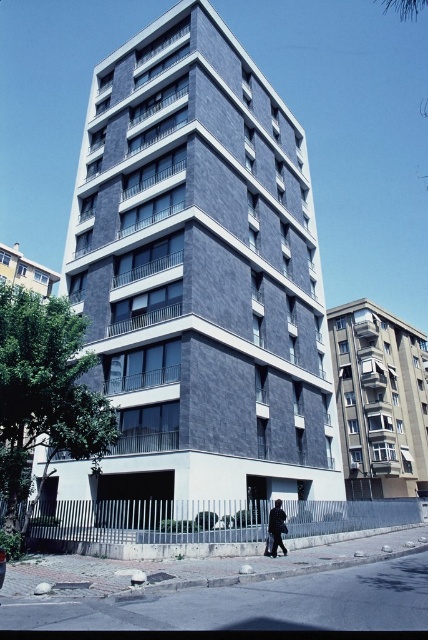
Is point (372, 413) farther from camera compared to point (8, 280)?

That is False.

Identify the location of dark gray stone building at right. click(x=380, y=401).

Between dark gray stone building at center and dark blue jacket at lower center, which one appears on the right side from the viewer's perspective?

dark blue jacket at lower center

Is dark gray stone building at center bigger than dark blue jacket at lower center?

Indeed, dark gray stone building at center has a larger size compared to dark blue jacket at lower center.

What do you see at coordinates (196, 285) in the screenshot?
I see `dark gray stone building at center` at bounding box center [196, 285].

Locate an element on the screen. The width and height of the screenshot is (428, 640). dark gray stone building at center is located at coordinates (196, 285).

Which is above, dark gray stone building at center or dark gray stone building at right?

dark gray stone building at center

Can you confirm if dark gray stone building at center is wider than dark gray stone building at right?

No.

Which is in front, point (109, 472) or point (365, 480)?

Point (109, 472) is in front.

Where is `dark gray stone building at center`? The height and width of the screenshot is (640, 428). dark gray stone building at center is located at coordinates (196, 285).